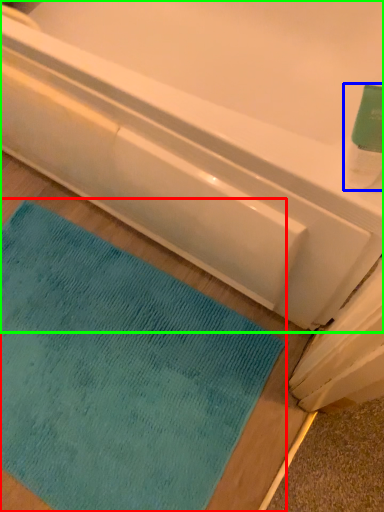
Question: Which is nearer to the mat (highlighted by a red box)? cleaning product (highlighted by a blue box) or bathtub (highlighted by a green box).

Choices:
 (A) cleaning product
 (B) bathtub

Answer: (B)